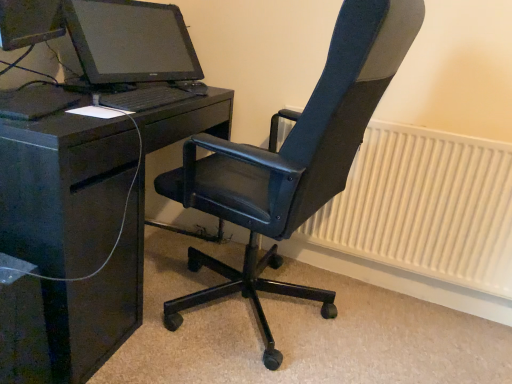
Where is `free space that is in between black leather office chair at center and white textured radiator at right`? This screenshot has width=512, height=384. free space that is in between black leather office chair at center and white textured radiator at right is located at coordinates (403, 332).